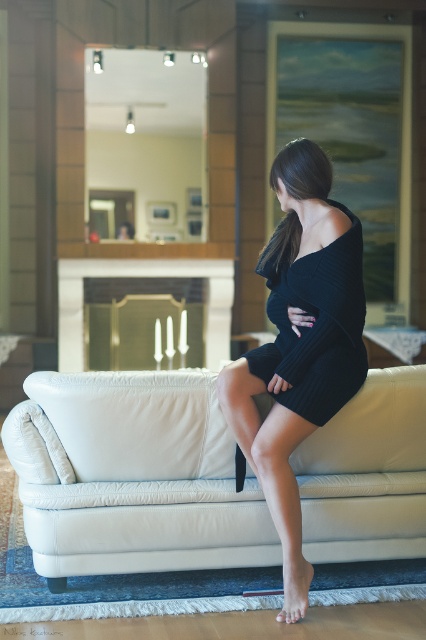
You are a photographer standing in the living room. You want to take a photo of the white leather couch at center and the black ribbed dress at center. The camera you are using has a minimum focus distance of 20 inches. Can you focus on both objects without moving closer than the minimum distance?

The distance between the white leather couch at center and the black ribbed dress at center is 21.44 inches, which is greater than the camera minimum focus distance of 20 inches. Therefore, you can focus on both objects without moving closer than the minimum distance.

You are an interior designer analyzing the outfit of the woman in the image. You notice two dresses described as black knitted dress at center and black ribbed dress at center. Which dress is positioned lower on her body?

The black knitted dress at center is located below the black ribbed dress at center, so the black knitted dress at center is positioned lower on her body.

You are standing in the living room and want to sit down on the white leather couch at center. Based on the coordinates provided, in which general direction should you walk to reach it?

The white leather couch at center is located at coordinates point [132,476], which means it is positioned towards the right side and slightly forward in the room. You should walk towards the right and slightly forward to reach it.